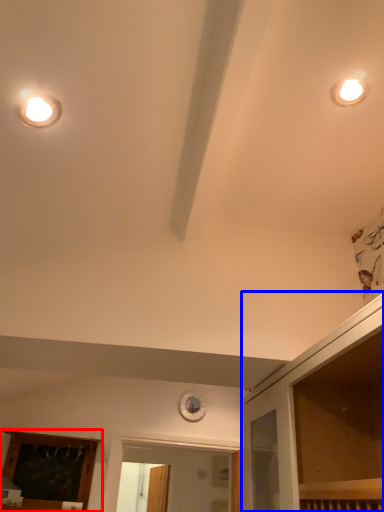
Question: Which object appears closest to the camera in this image, elevator (highlighted by a red box) or dresser (highlighted by a blue box)?

Choices:
 (A) elevator
 (B) dresser

Answer: (B)